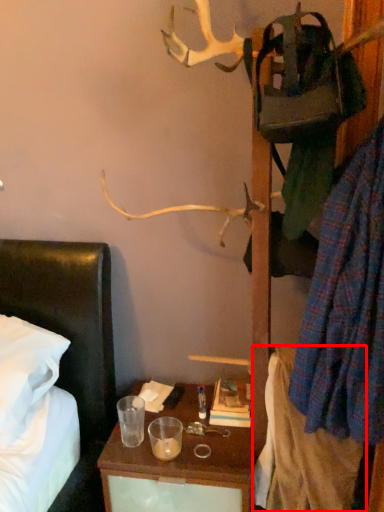
Question: Considering the relative positions of clothing (annotated by the red box) and clothing in the image provided, where is clothing (annotated by the red box) located with respect to the staircase?

Choices:
 (A) right
 (B) left

Answer: (B)